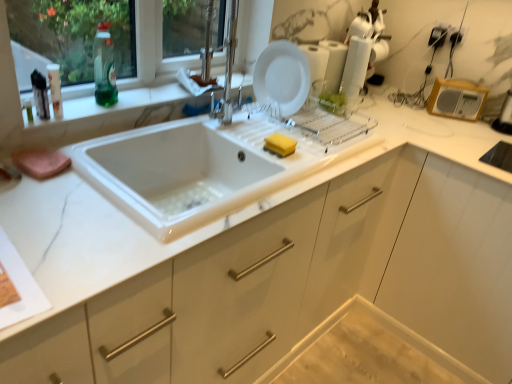
Question: Considering their positions, is white glossy plate at upper center, which is the second appliance from right to left, located in front of or behind wooden radio at upper right, placed as the 2th appliance when sorted from left to right?

Choices:
 (A) behind
 (B) front

Answer: (B)

Question: From their relative heights in the image, would you say white glossy plate at upper center, the first appliance positioned from the left, is taller or shorter than wooden radio at upper right, marked as the first appliance in a right-to-left arrangement?

Choices:
 (A) tall
 (B) short

Answer: (A)

Question: Which is nearer to the white glossy sink at center?

Choices:
 (A) yellow sponge at sink
 (B) white glossy plate at upper center, which is the second appliance from right to left
 (C) marble-like white at left
 (D) wooden radio at upper right, placed as the 2th appliance when sorted from left to right
 (E) green translucent bottle at upper left, the 1th bottle viewed from the back

Answer: (C)

Question: Estimate the real-world distances between objects in this image. Which object is closer to the marble-like white at left?

Choices:
 (A) white glossy plate at upper center, which is the second appliance from right to left
 (B) green translucent bottle at upper left, which is the second bottle in left-to-right order
 (C) yellow sponge at sink
 (D) wooden radio at upper right, marked as the first appliance in a right-to-left arrangement
 (E) white matte plate at upper center

Answer: (B)